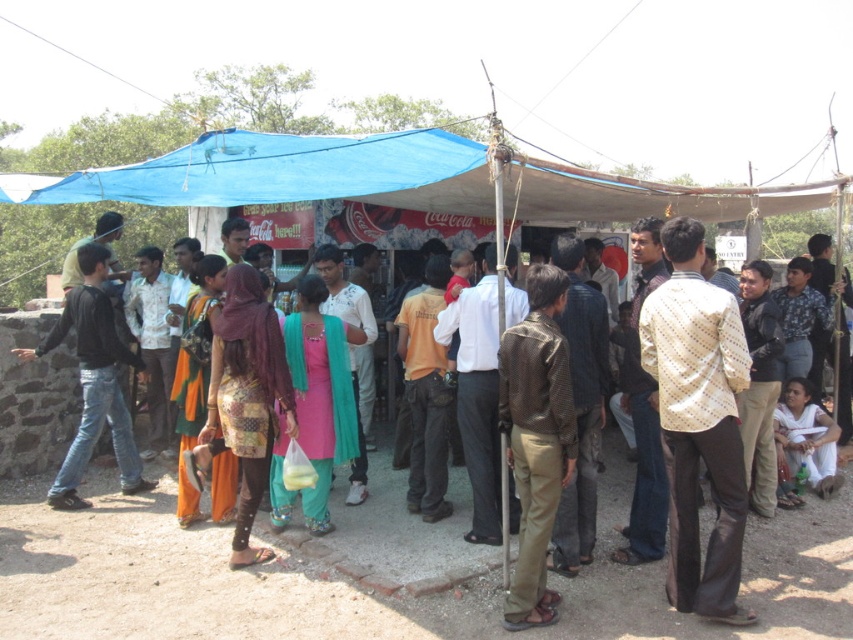
Question: Estimate the real-world distances between objects in this image. Which object is farther from the light beige dotted shirt at center?

Choices:
 (A) jeans at left
 (B) white cotton dress at lower right
 (C) brown textured shirt at center

Answer: (A)

Question: Does light beige dotted shirt at center come behind white cotton dress at lower right?

Choices:
 (A) no
 (B) yes

Answer: (A)

Question: Which of the following is the closest to the observer?

Choices:
 (A) white cotton dress at lower right
 (B) light beige dotted shirt at center
 (C) brown textured shirt at center

Answer: (B)

Question: Among these points, which one is farthest from the camera?

Choices:
 (A) (816, 481)
 (B) (541, 598)

Answer: (A)

Question: Does light beige dotted shirt at center have a smaller size compared to brown textured shirt at center?

Choices:
 (A) no
 (B) yes

Answer: (A)

Question: Does brown textured shirt at center have a greater width compared to jeans at left?

Choices:
 (A) no
 (B) yes

Answer: (A)